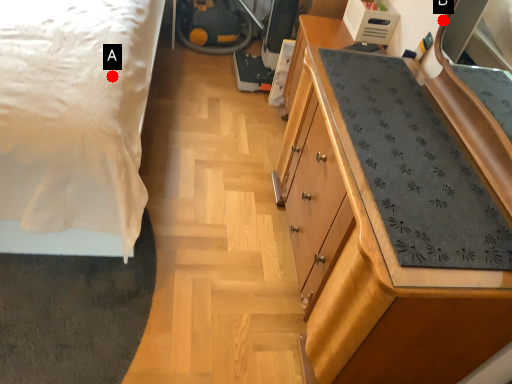
Question: Two points are circled on the image, labeled by A and B beside each circle. Which point is further to the camera?

Choices:
 (A) A is further
 (B) B is further

Answer: (B)